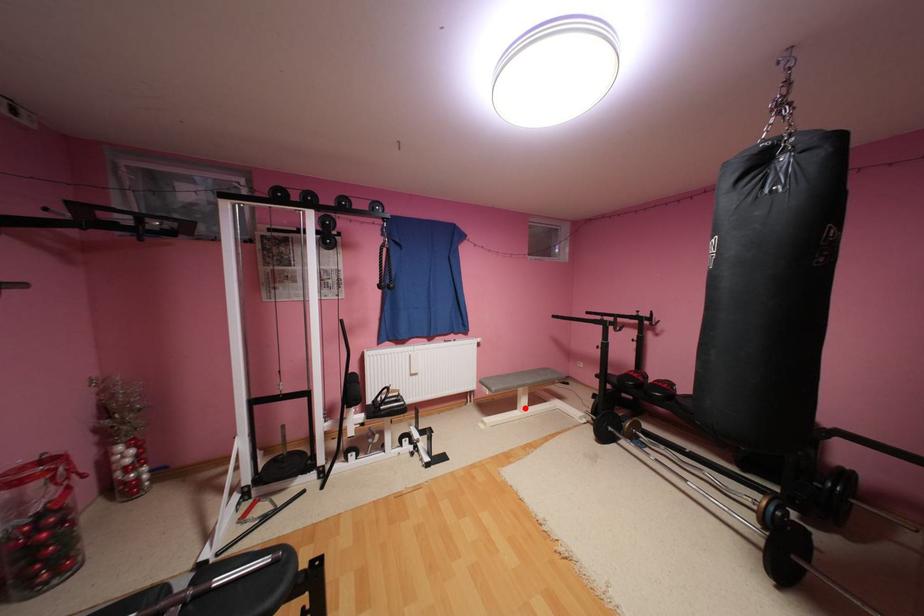
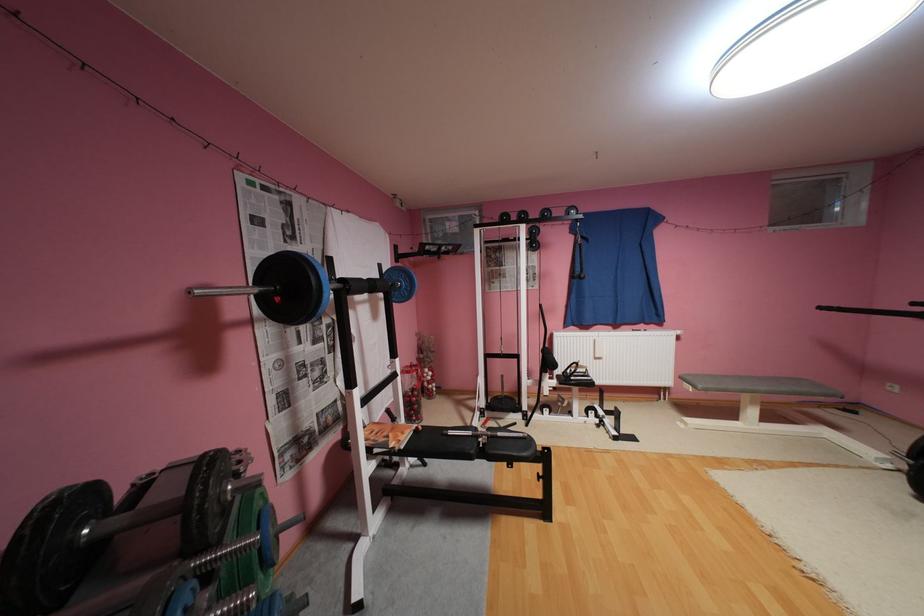
Question: A red point is marked in image1. In image2, is the corresponding 3D point closer to the camera or farther? Reply with the corresponding letter.

Choices:
 (A) The corresponding 3D point is closer.
 (B) The corresponding 3D point is farther.

Answer: (A)